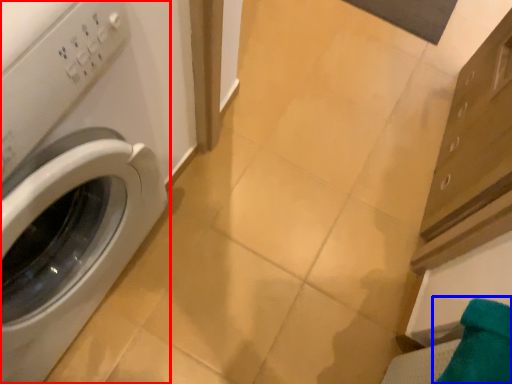
Question: Which of the following is the farthest to the observer, washing machine (highlighted by a red box) or bath towel (highlighted by a blue box)?

Choices:
 (A) washing machine
 (B) bath towel

Answer: (B)